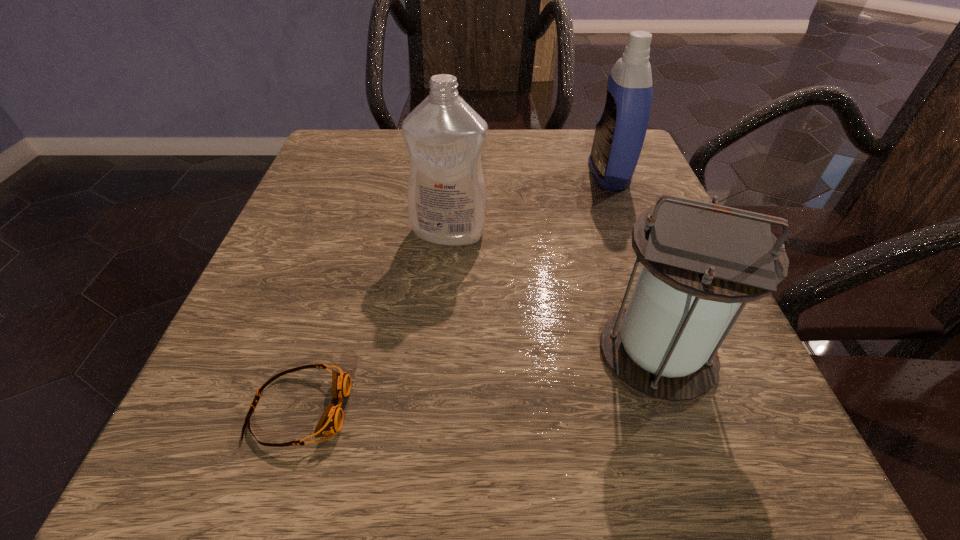
You are a GUI agent. You are given a task and a screenshot of the screen. Output one action in this format:
    pyautogui.click(x=<x>, y=<y>)
    Task: Click on the free space located 0.100m with the lenses facing forward on the leftmost object
    Image resolution: width=960 pixels, height=540 pixels.
    Given the screenshot: What is the action you would take?
    pyautogui.click(x=429, y=409)

The height and width of the screenshot is (540, 960). I want to click on object located in the far edge section of the desktop, so click(x=620, y=131).

Where is `object positioned at the near edge`? This screenshot has width=960, height=540. object positioned at the near edge is located at coordinates (331, 421).

Identify the location of object that is at the left edge. Image resolution: width=960 pixels, height=540 pixels. (331, 421).

Find the location of a particular element. detergent at the right edge is located at coordinates (620, 131).

Image resolution: width=960 pixels, height=540 pixels. I want to click on lantern positioned at the right edge, so click(x=700, y=260).

At what (x,y) coordinates should I click in order to perform the action: click on object that is positioned at the near left corner. Please return your answer as a coordinate pair (x, y). Looking at the image, I should click on (331, 421).

In order to click on object positioned at the far right corner in this screenshot , I will do `click(620, 131)`.

The height and width of the screenshot is (540, 960). Identify the location of blank space at the far edge of the desktop. (405, 148).

The width and height of the screenshot is (960, 540). I want to click on vacant space at the near edge of the desktop, so click(410, 470).